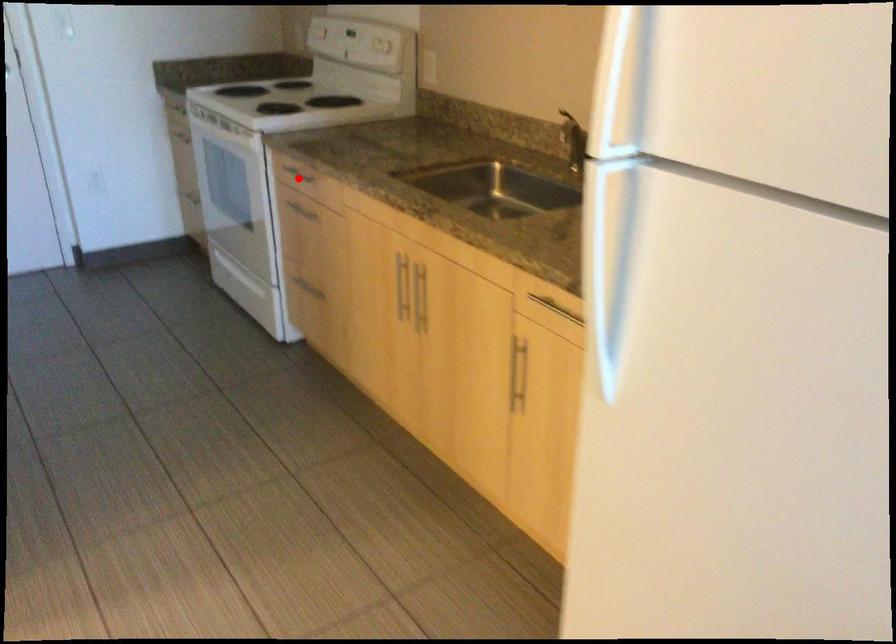
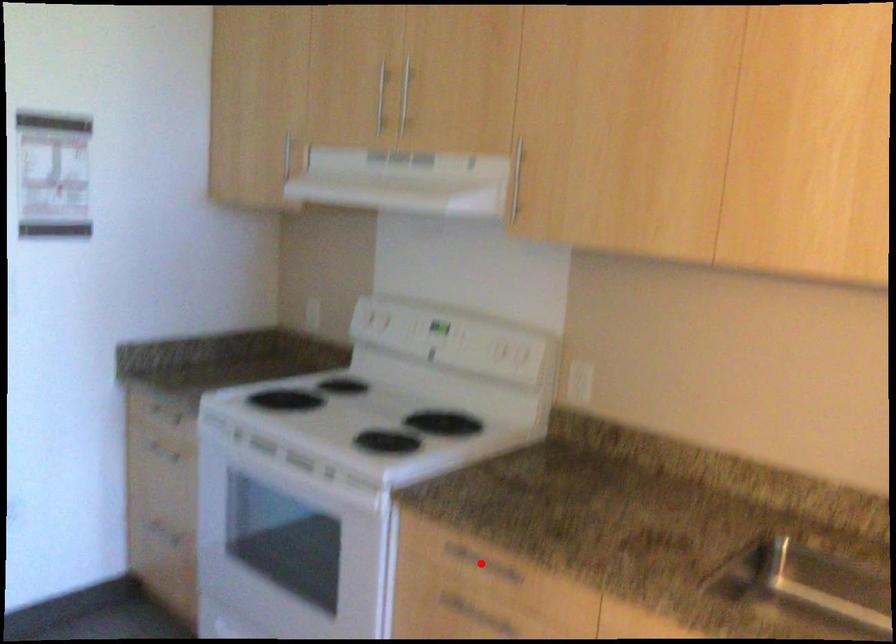
I am providing you with two images of the same scene from different viewpoints. A red point is marked on the first image and another point is marked on the second image. Are the points marked in image1 and image2 representing the same 3D position?

Yes